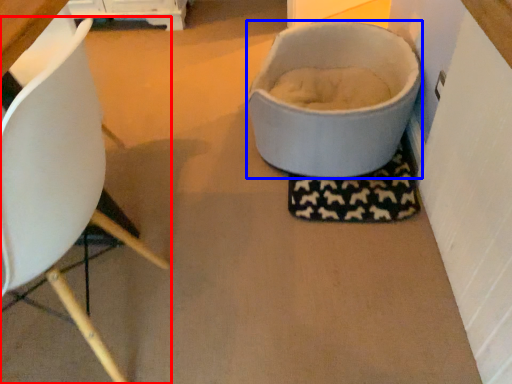
Question: Which object is further to the camera taking this photo, chair (highlighted by a red box) or toilet bowl (highlighted by a blue box)?

Choices:
 (A) chair
 (B) toilet bowl

Answer: (B)